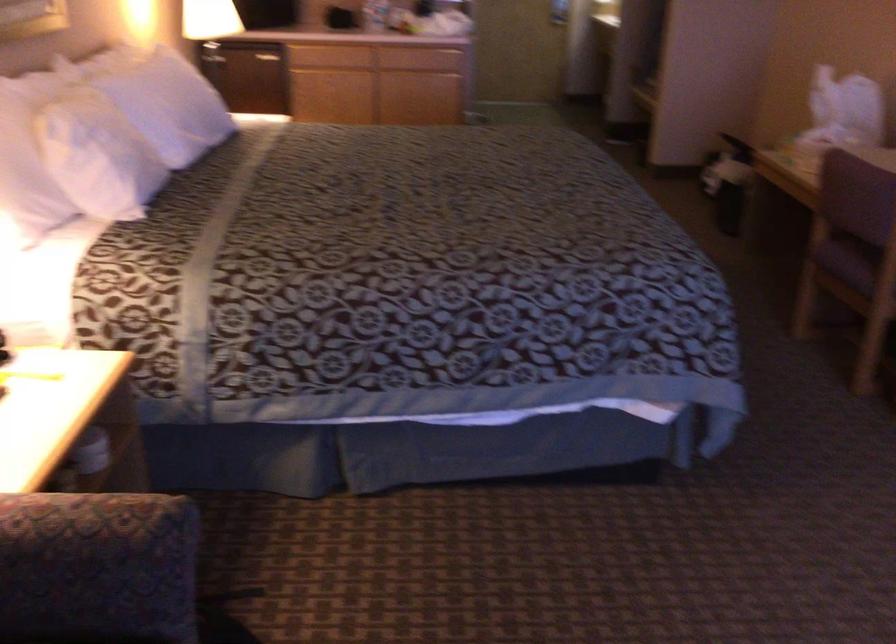
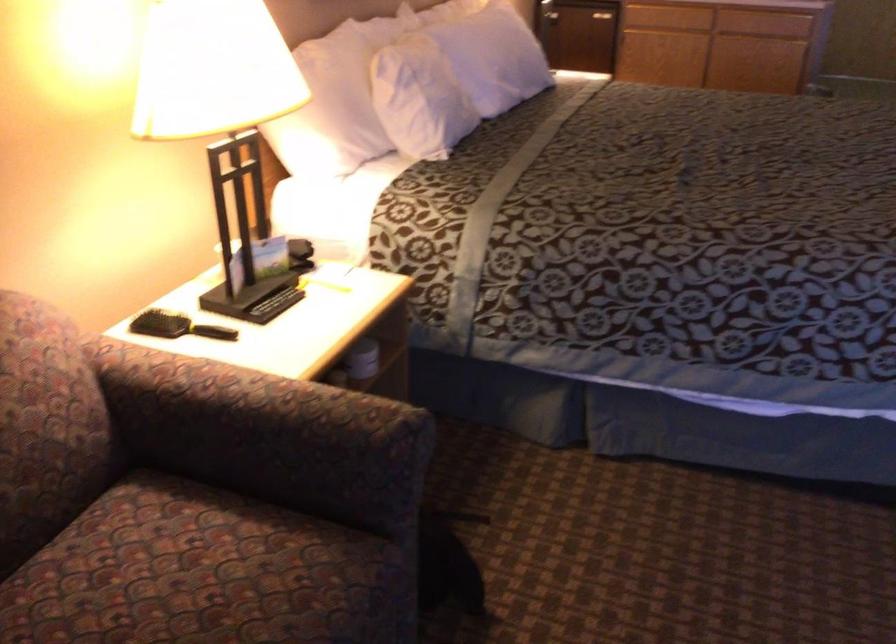
Question: Which direction would the cameraman need to move to produce the second image? Reply with the corresponding letter.

Choices:
 (A) Left
 (B) Right
 (C) Forward
 (D) Backward

Answer: (B)